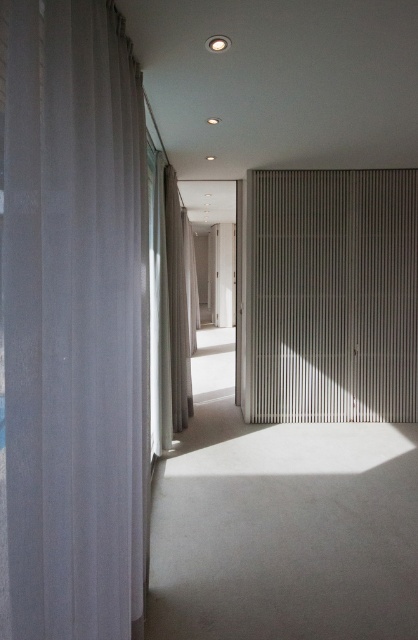
Question: Based on their relative distances, which object is farther from the clear glass screen door at center?

Choices:
 (A) sheer white curtain at left
 (B) metallic silver blinds at right
 (C) white sheer curtain at left

Answer: (A)

Question: Is sheer white curtain at left to the right of white sheer curtain at left from the viewer's perspective?

Choices:
 (A) yes
 (B) no

Answer: (A)

Question: Is sheer white curtain at left to the left of clear glass screen door at center from the viewer's perspective?

Choices:
 (A) no
 (B) yes

Answer: (B)

Question: From the image, what is the correct spatial relationship of sheer white curtain at left in relation to white sheer curtain at left?

Choices:
 (A) above
 (B) below

Answer: (B)

Question: Which object appears farthest from the camera in this image?

Choices:
 (A) metallic silver blinds at right
 (B) clear glass screen door at center

Answer: (B)

Question: Among these points, which one is nearest to the camera?

Choices:
 (A) (175, 349)
 (B) (219, 230)
 (C) (50, 243)

Answer: (C)